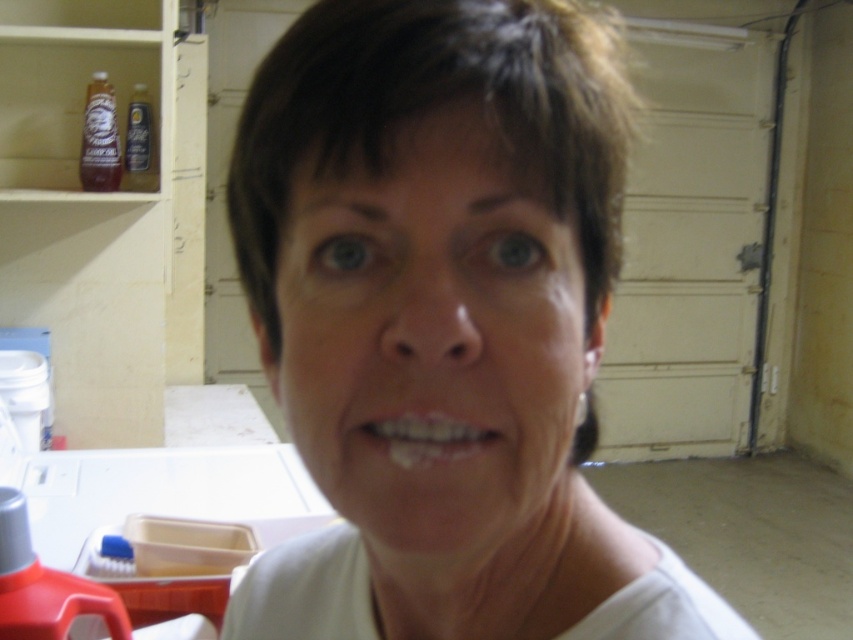
Question: Is white matte shirt at center to the left of white glossy teeth at center from the viewer's perspective?

Choices:
 (A) yes
 (B) no

Answer: (B)

Question: Which point appears farthest from the camera in this image?

Choices:
 (A) (361, 428)
 (B) (602, 97)

Answer: (B)

Question: Which point appears farthest from the camera in this image?

Choices:
 (A) (418, 442)
 (B) (480, 556)

Answer: (B)

Question: Can you confirm if white matte shirt at center is positioned below white glossy teeth at center?

Choices:
 (A) yes
 (B) no

Answer: (A)

Question: Which object is farther from the camera taking this photo?

Choices:
 (A) white matte shirt at center
 (B) white glossy teeth at center

Answer: (B)

Question: Where is white matte shirt at center located in relation to white glossy teeth at center in the image?

Choices:
 (A) above
 (B) below

Answer: (B)